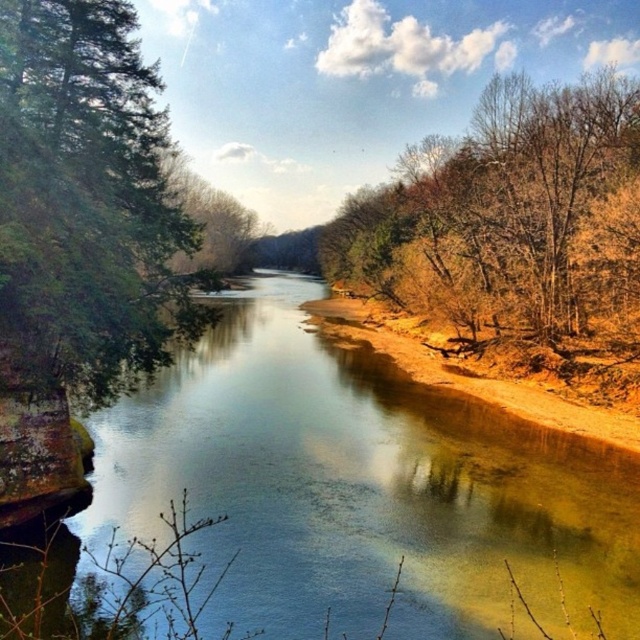
You are standing at the edge of the river on the left bank and want to cross to the right bank. The clear water at center is in your path. Based on its position, can you step over it directly from the left bank to the right bank without getting your feet wet?

The clear water at center is located at point [356,488], which means it is positioned in the middle of the river. Since you are on the left bank, you would need to wade through the water to reach the right bank, so your feet will get wet.

You are standing on the riverbank and want to take a photo of both the green textured tree at left and the brown leafy tree at right. Which tree should you position closer to the camera to include both in the frame?

You should position the green textured tree at left closer to the camera since it is already in front of the brown leafy tree at right, allowing both to be captured in the frame without needing to adjust their positions significantly.

You are planning to cross the river using a small inflatable boat that can only hold a maximum width of 2 meters. Based on the scene, can you safely navigate the clear water at center between the green textured tree at left and the opposite bank?

The clear water at center is wider than the green textured tree at left, but since the exact width of the water isn